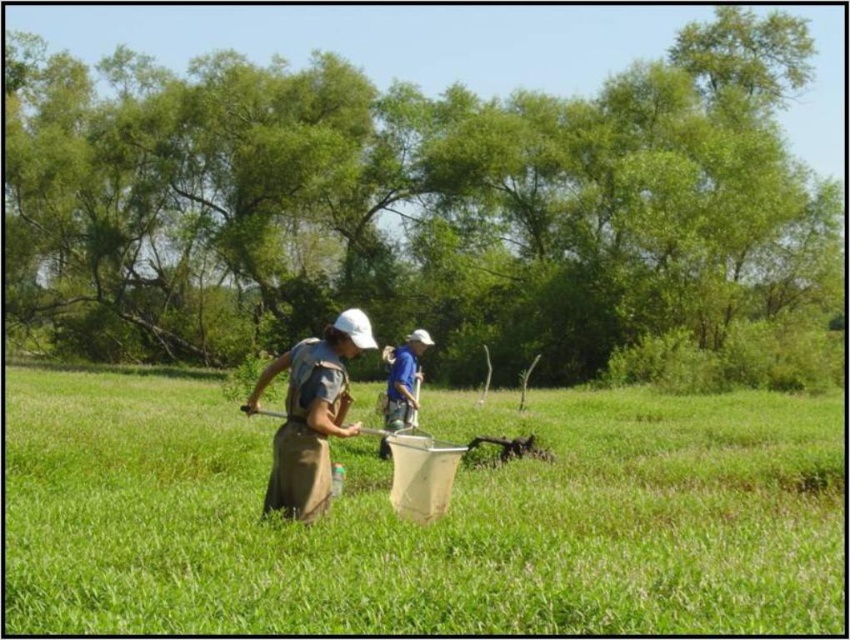
You are a researcher who needs to place a 2.5 meter long equipment between the green grass at center and the brown canvas apron at center. Is there enough space to do so without moving either object?

The distance between the green grass at center and the brown canvas apron at center is 3.65 meters. Since the equipment is 2.5 meters long, there is sufficient space to place it between them without moving either object.

You are a researcher in the field and need to access the metallic silver shovel at center to dig up a sample. However, the brown canvas apron at center is blocking your access. Can you move the apron to retrieve the shovel?

The brown canvas apron at center is positioned over the metallic silver shovel at center, so moving the apron would allow you to access the shovel.